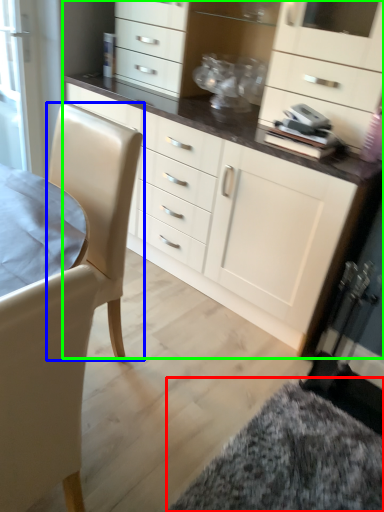
Question: Considering the real-world distances, which object is closest to wide (highlighted by a red box)? swivel chair (highlighted by a blue box) or cabinetry (highlighted by a green box).

Choices:
 (A) swivel chair
 (B) cabinetry

Answer: (B)